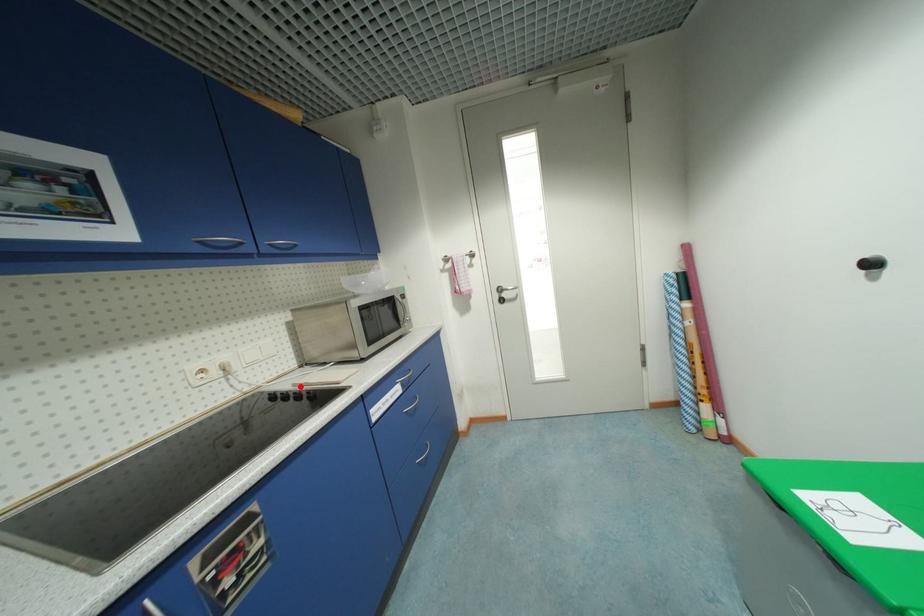
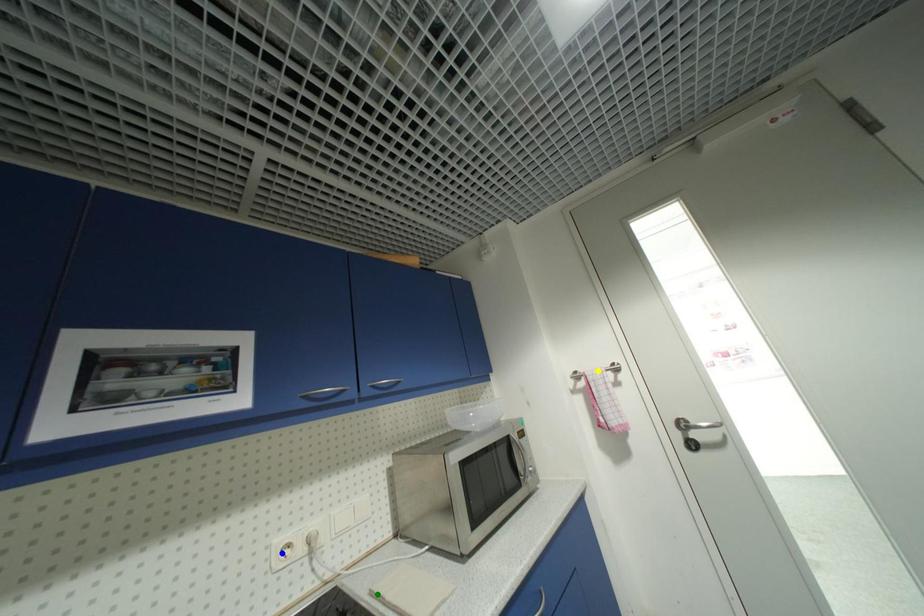
Question: I am providing you with two images of the same scene from different viewpoints. A red point is marked on the first image. You are given multiple points on the second image. Can you choose the point in image 2 that corresponds to the point in image 1?

Choices:
 (A) blue point
 (B) yellow point
 (C) green point

Answer: (C)